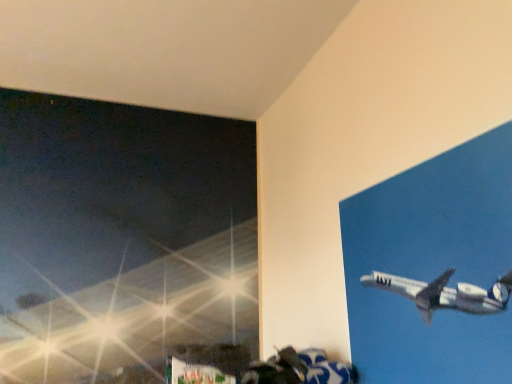
At what (x,y) coordinates should I click in order to perform the action: click on transparent glass window at upper left. Please return your answer as a coordinate pair (x, y). The image size is (512, 384). Looking at the image, I should click on (121, 237).

This screenshot has width=512, height=384. Describe the element at coordinates (121, 237) in the screenshot. I see `transparent glass window at upper left` at that location.

Identify the location of transparent glass window at upper left. (121, 237).